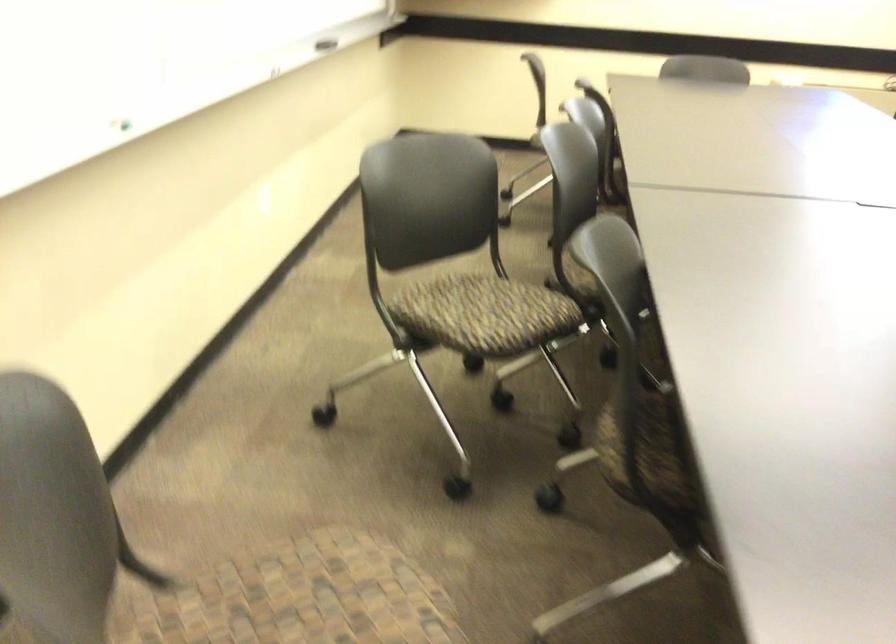
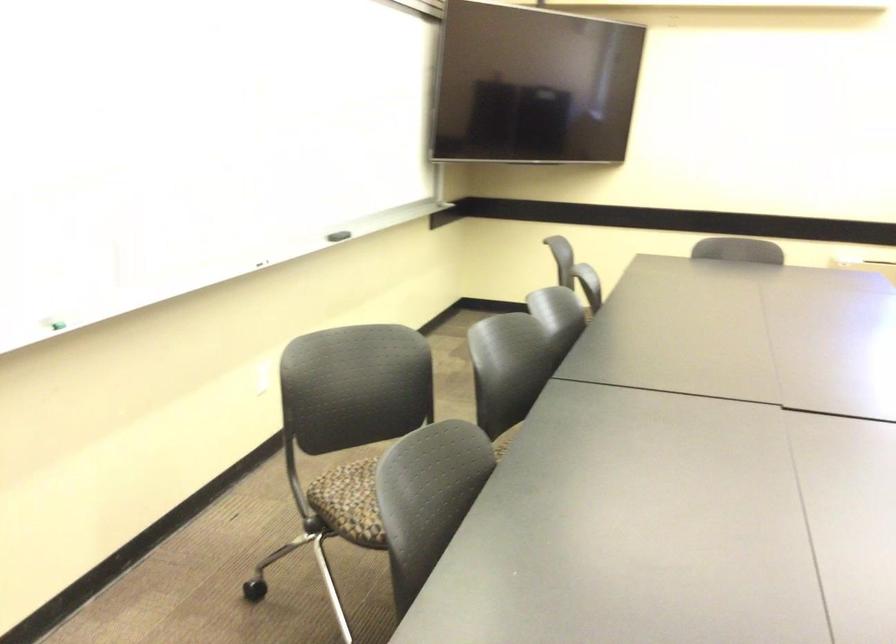
Question: I am providing you with two images of the same scene from different viewpoints. After the viewpoint changes to image2, which objects are now occluded?

Choices:
 (A) light green binder
 (B) patterned chair sitting surface
 (C) green whiteboard marker
 (D) chair sitting surface

Answer: (D)